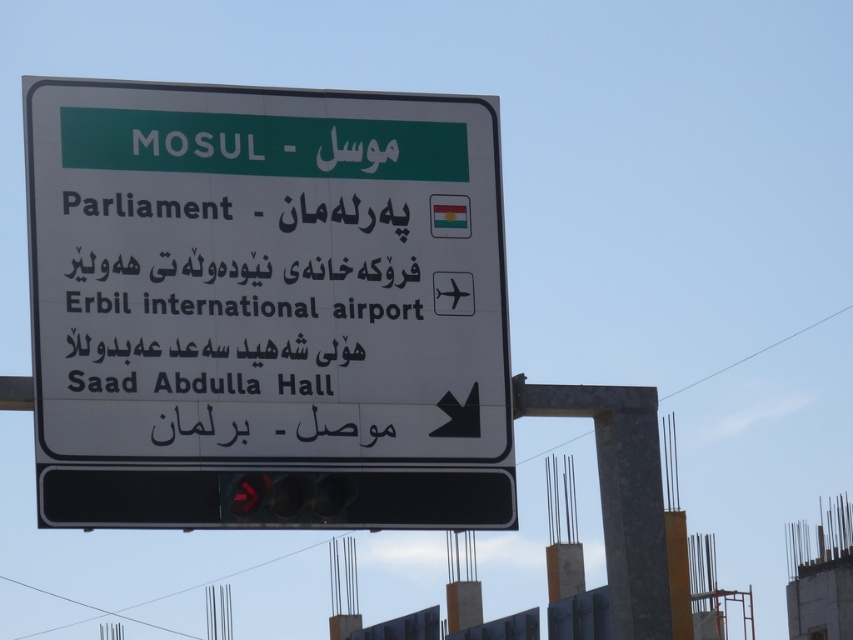
Is white plastic sign at center below black text at center?

No, white plastic sign at center is not below black text at center.

Describe the element at coordinates (265, 301) in the screenshot. I see `white plastic sign at center` at that location.

Where is `white plastic sign at center`? white plastic sign at center is located at coordinates (265, 301).

Does white plastic sign at center lie in front of red glass traffic light at bottom center?

Yes.

Measure the distance between white plastic sign at center and red glass traffic light at bottom center.

white plastic sign at center is 10.07 feet from red glass traffic light at bottom center.

What do you see at coordinates (265, 301) in the screenshot? This screenshot has height=640, width=853. I see `white plastic sign at center` at bounding box center [265, 301].

This screenshot has height=640, width=853. I want to click on white plastic sign at center, so click(265, 301).

Between black text at center and red glass traffic light at bottom center, which one appears on the right side from the viewer's perspective?

red glass traffic light at bottom center

Is black text at center further to camera compared to red glass traffic light at bottom center?

No, black text at center is in front of red glass traffic light at bottom center.

At what (x,y) coordinates should I click in order to perform the action: click on black text at center. Please return your answer as a coordinate pair (x, y). Image resolution: width=853 pixels, height=640 pixels. Looking at the image, I should click on (239, 320).

This screenshot has height=640, width=853. Identify the location of black text at center. coord(239,320).